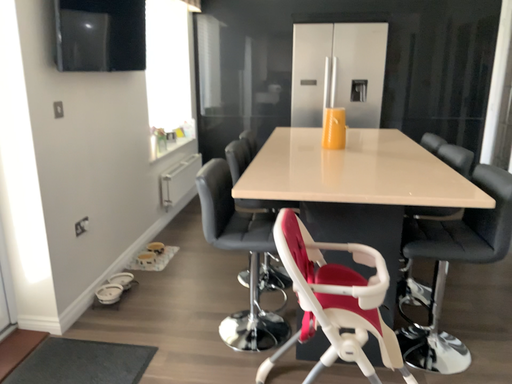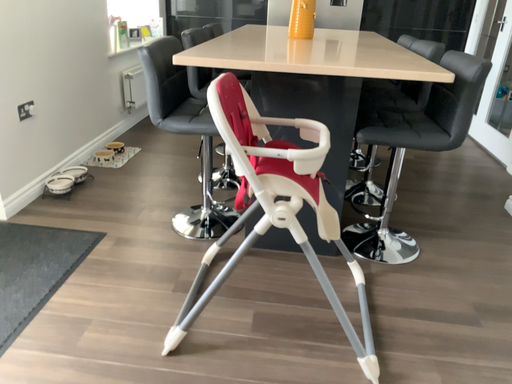
Question: Which way did the camera rotate in the video?

Choices:
 (A) rotated upward
 (B) rotated downward

Answer: (B)